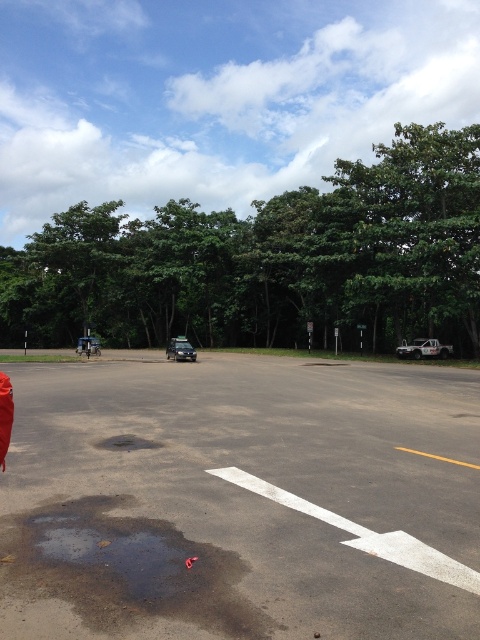
Is gray asphalt parking lot at center smaller than brown matte puddle at center?

Incorrect, gray asphalt parking lot at center is not smaller in size than brown matte puddle at center.

Is point (346, 394) closer to viewer compared to point (126, 440)?

No, it is behind (126, 440).

At what (x,y) coordinates should I click in order to perform the action: click on gray asphalt parking lot at center. Please return your answer as a coordinate pair (x, y). Looking at the image, I should click on (240, 500).

Does gray asphalt parking lot at center appear on the right side of white glossy car at lower right?

In fact, gray asphalt parking lot at center is to the left of white glossy car at lower right.

Where is `gray asphalt parking lot at center`? The height and width of the screenshot is (640, 480). gray asphalt parking lot at center is located at coordinates (240, 500).

This screenshot has width=480, height=640. What are the coordinates of `gray asphalt parking lot at center` in the screenshot? It's located at (240, 500).

Is point (425, 339) positioned before point (192, 355)?

No, it is behind (192, 355).

Identify the location of white glossy car at lower right. This screenshot has height=640, width=480. (423, 348).